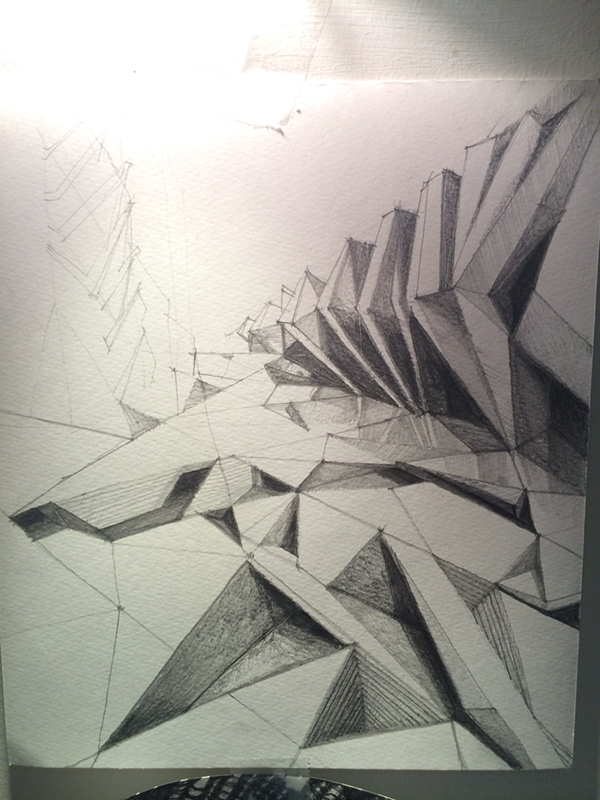
Where is `white wall`? white wall is located at coordinates (508, 37).